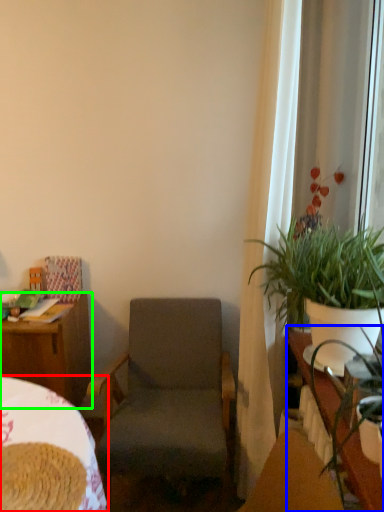
Question: Based on their relative distances, which object is farther from bed (highlighted by a red box)? Choose from table (highlighted by a blue box) and desk (highlighted by a green box).

Choices:
 (A) table
 (B) desk

Answer: (A)